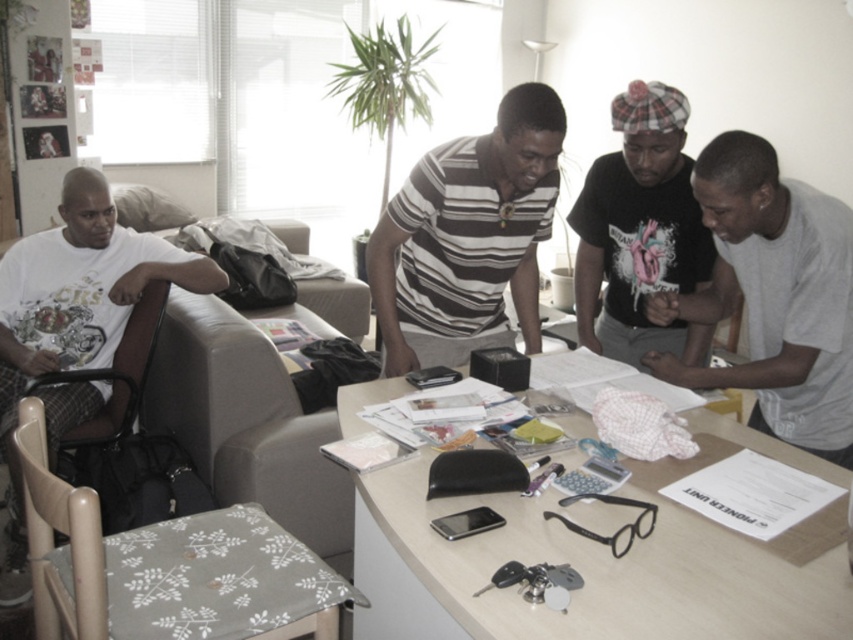
Question: From the image, what is the correct spatial relationship of light brown fabric armchair at left in relation to white cotton t-shirt at left?

Choices:
 (A) below
 (B) above

Answer: (A)

Question: Among these objects, which one is farthest from the camera?

Choices:
 (A) striped cotton shirt at center
 (B) gray cotton shirt at center

Answer: (A)

Question: Considering the relative positions of light brown fabric armchair at left and gray cotton shirt at center in the image provided, where is light brown fabric armchair at left located with respect to gray cotton shirt at center?

Choices:
 (A) below
 (B) above

Answer: (A)

Question: Which of these objects is positioned closest to the striped cotton shirt at center?

Choices:
 (A) black matte shirt at center
 (B) gray cotton shirt at center

Answer: (A)

Question: Which of these objects is positioned closest to the gray cotton shirt at center?

Choices:
 (A) white cotton t-shirt at left
 (B) wooden table at center

Answer: (B)

Question: Can you confirm if gray cotton shirt at center is thinner than striped cotton shirt at center?

Choices:
 (A) no
 (B) yes

Answer: (B)